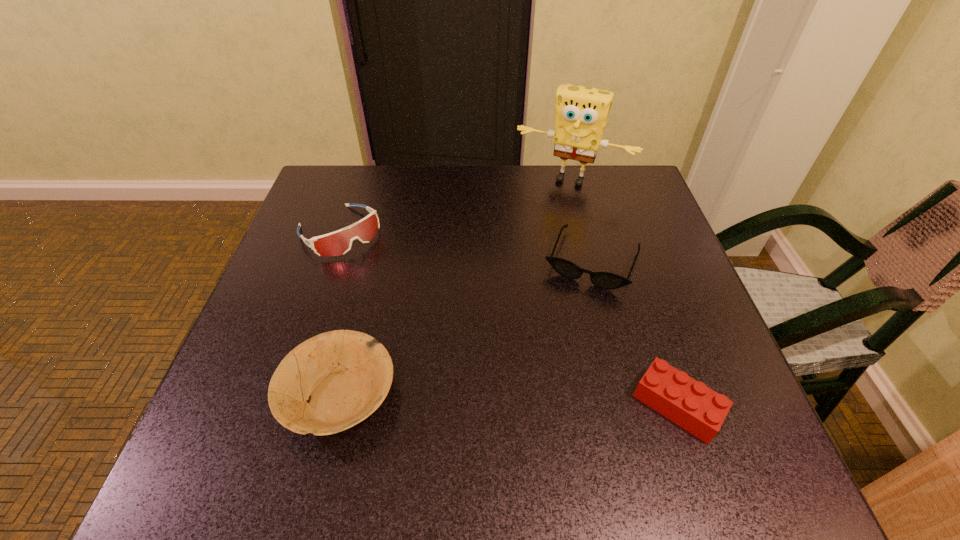
Where is `empty space that is in between the tallest object and the Lego`? empty space that is in between the tallest object and the Lego is located at coordinates (624, 292).

You are a GUI agent. You are given a task and a screenshot of the screen. Output one action in this format:
    pyautogui.click(x=<x>, y=<y>)
    Task: Click on the free space between the sunglasses and the second tallest object
    The width and height of the screenshot is (960, 540).
    Given the screenshot: What is the action you would take?
    pyautogui.click(x=466, y=246)

You are a GUI agent. You are given a task and a screenshot of the screen. Output one action in this format:
    pyautogui.click(x=<x>, y=<y>)
    Task: Click on the free spot between the fourth shortest object and the sunglasses
    
    Given the screenshot: What is the action you would take?
    pyautogui.click(x=466, y=246)

I want to click on free area in between the fourth shortest object and the sunglasses, so click(x=466, y=246).

What are the coordinates of `unoccupied area between the bowl and the goggles` in the screenshot? It's located at (339, 313).

At what (x,y) coordinates should I click in order to perform the action: click on vacant space that's between the Lego and the sunglasses. Please return your answer as a coordinate pair (x, y). The image size is (960, 540). Looking at the image, I should click on (635, 333).

I want to click on unoccupied position between the bowl and the fourth shortest object, so click(339, 313).

Identify which object is located as the nearest to the goggles. Please provide its 2D coordinates. Your answer should be formatted as a tuple, i.e. [(x, y)], where the tuple contains the x and y coordinates of a point satisfying the conditions above.

[(345, 375)]

Select which object is the second closest to the sunglasses. Please provide its 2D coordinates. Your answer should be formatted as a tuple, i.e. [(x, y)], where the tuple contains the x and y coordinates of a point satisfying the conditions above.

[(692, 405)]